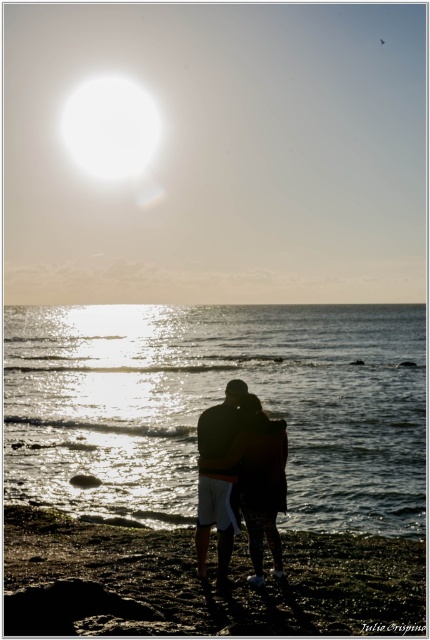
You are standing on the beach and want to walk towards the silhouette fabric couple at center. Which direction should you move relative to the smooth sand at lower center?

Since the smooth sand at lower center is closer to you than the silhouette fabric couple at center, you should move away from the smooth sand at lower center to reach the silhouette fabric couple at center.

You are planning to build a sandcastle on the beach. Given the sizes of the smooth sand at lower center and the silhouette fabric couple at center, which area would be more suitable for building a small sandcastle?

The smooth sand at lower center has a smaller size compared to the silhouette fabric couple at center, so the smooth sand at lower center is more suitable for building a small sandcastle since it requires less space.

You are standing on the beach and see two points marked in the scene. The first point is at coordinates point (76, 564) and the second point is at point (255, 516). Which point is closer to the horizon line?

Point (76, 564) is behind point (255, 516), so the second point is closer to the horizon line.